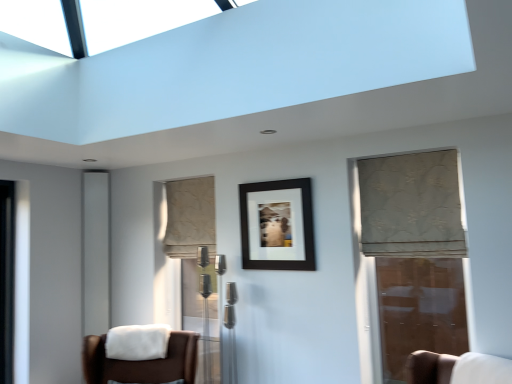
Question: Is white fabric chair at lower right, which is counted as the 2th chair, starting from the left, at the back of transparent glass door at right?

Choices:
 (A) yes
 (B) no

Answer: (B)

Question: Considering the relative sizes of transparent glass door at right and white fabric chair at lower right, the first chair positioned from the right, in the image provided, is transparent glass door at right wider than white fabric chair at lower right, the first chair positioned from the right,?

Choices:
 (A) yes
 (B) no

Answer: (B)

Question: From the image's perspective, would you say transparent glass door at right is positioned over white fabric chair at lower right, which is counted as the 2th chair, starting from the left?

Choices:
 (A) yes
 (B) no

Answer: (A)

Question: Is transparent glass door at right outside white fabric chair at lower right, which is counted as the 2th chair, starting from the left?

Choices:
 (A) no
 (B) yes

Answer: (B)

Question: From a real-world perspective, is transparent glass door at right located higher than white fabric chair at lower right, the first chair positioned from the right?

Choices:
 (A) no
 (B) yes

Answer: (B)

Question: Is beige floral fabric curtain at right, the 2th curtain when ordered from back to front, wider or thinner than white soft fabric at lower left?

Choices:
 (A) thin
 (B) wide

Answer: (B)

Question: Considering the positions of beige floral fabric curtain at right, positioned as the first curtain in right-to-left order, and white soft fabric at lower left in the image, is beige floral fabric curtain at right, positioned as the first curtain in right-to-left order, bigger or smaller than white soft fabric at lower left?

Choices:
 (A) small
 (B) big

Answer: (B)

Question: In the image, is beige floral fabric curtain at right, arranged as the 1th curtain when viewed from the front, positioned in front of or behind white soft fabric at lower left?

Choices:
 (A) behind
 (B) front

Answer: (B)

Question: Is beige floral fabric curtain at right, the second curtain in the left-to-right sequence, taller or shorter than white soft fabric at lower left?

Choices:
 (A) tall
 (B) short

Answer: (A)

Question: Is transparent glass door at right in front of or behind white fabric chair at lower right, which is counted as the 2th chair, starting from the left, in the image?

Choices:
 (A) behind
 (B) front

Answer: (A)

Question: From the image's perspective, is transparent glass door at right above or below white fabric chair at lower right, which is counted as the 2th chair, starting from the left?

Choices:
 (A) below
 (B) above

Answer: (B)

Question: Is transparent glass door at right spatially inside white fabric chair at lower right, which is counted as the 2th chair, starting from the left, or outside of it?

Choices:
 (A) outside
 (B) inside

Answer: (A)

Question: Is point (438, 259) positioned closer to the camera than point (462, 365)?

Choices:
 (A) farther
 (B) closer

Answer: (A)

Question: Considering the positions of transparent glass door at right and beige textured curtain at center, the 1th curtain viewed from the back, in the image, is transparent glass door at right wider or thinner than beige textured curtain at center, the 1th curtain viewed from the back,?

Choices:
 (A) thin
 (B) wide

Answer: (A)

Question: Is point (429, 258) closer or farther from the camera than point (188, 251)?

Choices:
 (A) farther
 (B) closer

Answer: (B)